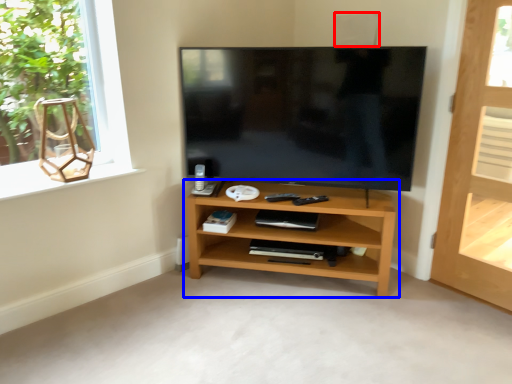
Question: Which object is further to the camera taking this photo, speaker (highlighted by a red box) or shelf (highlighted by a blue box)?

Choices:
 (A) speaker
 (B) shelf

Answer: (A)